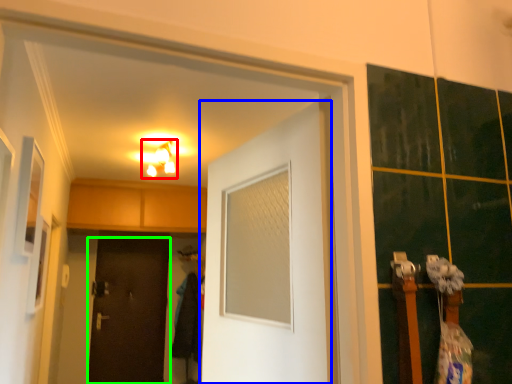
Question: Which object is the farthest from light fixture (highlighted by a red box)? Choose among these: door (highlighted by a blue box) or door (highlighted by a green box).

Choices:
 (A) door
 (B) door

Answer: (A)